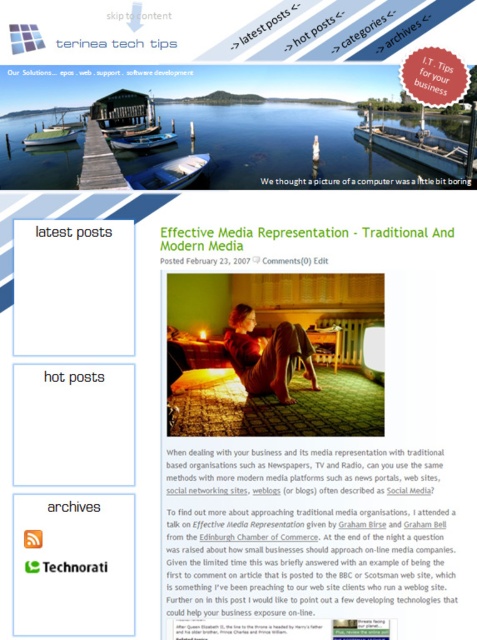
Does wooden dock at center lie behind blue glossy boat at center?

No, wooden dock at center is closer to the viewer.

Which is in front, point (84, 154) or point (207, 161)?

Positioned in front is point (84, 154).

Who is more forward, (118, 166) or (162, 170)?

Point (118, 166)

The height and width of the screenshot is (640, 477). What are the coordinates of `wooden dock at center` in the screenshot? It's located at (99, 161).

Which is in front, point (145, 173) or point (370, 180)?

Point (145, 173) is in front.

Who is more distant from viewer, (140, 184) or (465, 188)?

The point (465, 188) is behind.

Is point (186, 176) farther from camera compared to point (358, 179)?

No, (186, 176) is closer to viewer.

Find the location of a particular element. Image resolution: width=477 pixels, height=640 pixels. blue glossy boat at center is located at coordinates (169, 173).

Can you confirm if blue glossy boat at center is positioned above blue plastic boat at center?

Incorrect, blue glossy boat at center is not positioned above blue plastic boat at center.

Is blue glossy boat at center smaller than blue plastic boat at center?

No.

Is point (174, 180) farther from viewer compared to point (156, 134)?

No, (174, 180) is closer to viewer.

Locate an element on the screen. The width and height of the screenshot is (477, 640). blue glossy boat at center is located at coordinates (169, 173).